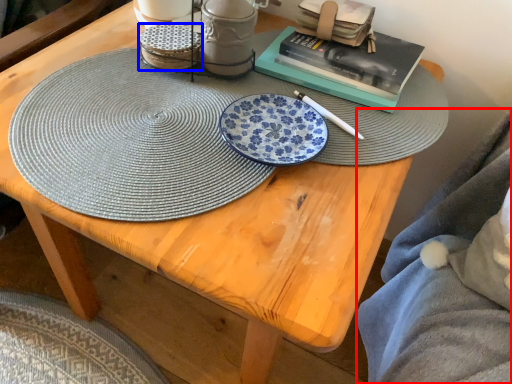
Question: Which point is closer to the camera, blanket (highlighted by a red box) or tableware (highlighted by a blue box)?

Choices:
 (A) blanket
 (B) tableware

Answer: (A)